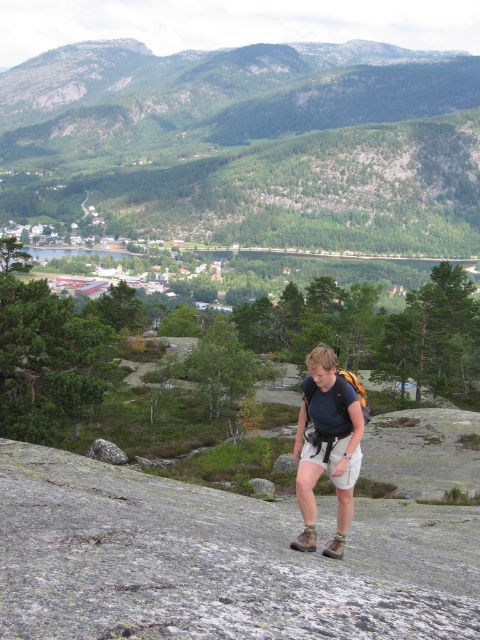
Question: Is gray rough stone at center wider than smooth gray rock at center?

Choices:
 (A) yes
 (B) no

Answer: (B)

Question: Is green forested mountain at upper center positioned at the back of gray rough rock at lower left?

Choices:
 (A) yes
 (B) no

Answer: (A)

Question: Which of the following is the closest to the observer?

Choices:
 (A) smooth gray rock at center
 (B) matte black backpack at center
 (C) gray rough rock at lower left
 (D) green forested mountain at upper center

Answer: (B)

Question: Which of these objects is positioned closest to the smooth gray rock at center?

Choices:
 (A) green forested mountain at upper center
 (B) gray rough rock at lower left

Answer: (B)

Question: Can you confirm if matte black backpack at center is bigger than smooth gray rock at center?

Choices:
 (A) no
 (B) yes

Answer: (B)

Question: Which point is closer to the camera taking this photo?

Choices:
 (A) (312, 404)
 (B) (316, 461)
 (C) (261, 486)
 (D) (278, 467)

Answer: (B)